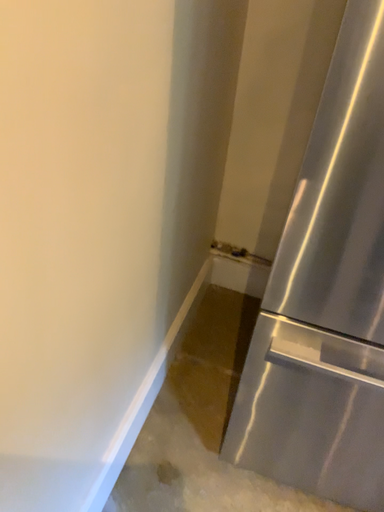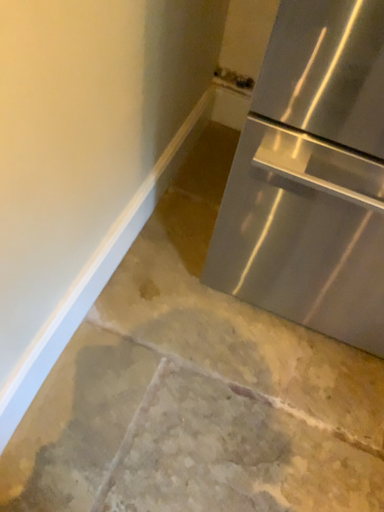
Question: How did the camera likely rotate when shooting the video?

Choices:
 (A) rotated downward
 (B) rotated upward

Answer: (A)